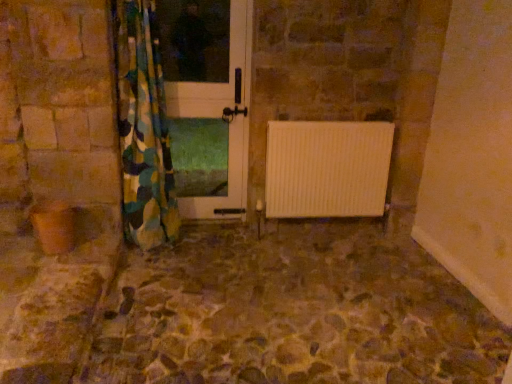
At what (x,y) coordinates should I click in order to perform the action: click on white glossy door at center. Please return your answer as a coordinate pair (x, y). Looking at the image, I should click on (219, 122).

Describe the element at coordinates (294, 311) in the screenshot. The width and height of the screenshot is (512, 384). I see `stone textured floor at center` at that location.

Locate an element on the screen. This screenshot has height=384, width=512. stone textured floor at center is located at coordinates (294, 311).

What do you see at coordinates (143, 128) in the screenshot? I see `camouflage fabric curtain at left` at bounding box center [143, 128].

The height and width of the screenshot is (384, 512). What are the coordinates of `white glossy door at center` in the screenshot? It's located at (219, 122).

Considering the relative sizes of white glossy door at center and stone textured floor at center in the image provided, is white glossy door at center taller than stone textured floor at center?

Yes, white glossy door at center is taller than stone textured floor at center.

In terms of size, does white glossy door at center appear bigger or smaller than stone textured floor at center?

In the image, white glossy door at center appears to be smaller than stone textured floor at center.

Considering the positions of objects white glossy door at center and stone textured floor at center in the image provided, who is behind, white glossy door at center or stone textured floor at center?

white glossy door at center.

Consider the image. Considering the relative positions of white glossy door at center and stone textured floor at center in the image provided, is white glossy door at center to the left of stone textured floor at center from the viewer's perspective?

Yes.

Choose the correct answer: Is stone textured floor at center inside camouflage fabric curtain at left or outside it?

stone textured floor at center cannot be found inside camouflage fabric curtain at left.

Based on the photo, from the image's perspective, who appears lower, stone textured floor at center or camouflage fabric curtain at left?

stone textured floor at center appears lower in the image.

Measure the distance from stone textured floor at center to camouflage fabric curtain at left.

A distance of 3.54 feet exists between stone textured floor at center and camouflage fabric curtain at left.

Between point (185, 301) and point (147, 118), which one is positioned behind?

The point (147, 118) is behind.

Based on their sizes in the image, would you say camouflage fabric curtain at left is bigger or smaller than white glossy door at center?

camouflage fabric curtain at left is bigger than white glossy door at center.

Is camouflage fabric curtain at left not close to white glossy door at center?

camouflage fabric curtain at left is near white glossy door at center, not far away.

Relative to white glossy door at center, is camouflage fabric curtain at left in front or behind?

Clearly, camouflage fabric curtain at left is in front of white glossy door at center.

From the image's perspective, which one is positioned lower, camouflage fabric curtain at left or white glossy door at center?

camouflage fabric curtain at left appears lower in the image.

This screenshot has width=512, height=384. I want to click on curtain below the white glossy door at center (from the image's perspective), so click(x=143, y=128).

Is white glossy door at center positioned far away from camouflage fabric curtain at left?

white glossy door at center is actually quite close to camouflage fabric curtain at left.

Which object is closer to the camera taking this photo, white glossy door at center or camouflage fabric curtain at left?

Answer: camouflage fabric curtain at left.

In the image, there is a stone textured floor at center. At what (x,y) coordinates should I click in order to perform the action: click on screen door above it (from the image's perspective). Please return your answer as a coordinate pair (x, y). Image resolution: width=512 pixels, height=384 pixels. Looking at the image, I should click on (219, 122).

Considering the sizes of stone textured floor at center and white glossy door at center in the image, is stone textured floor at center wider or thinner than white glossy door at center?

Clearly, stone textured floor at center has more width compared to white glossy door at center.

Is point (313, 372) more distant than point (212, 102)?

No, (313, 372) is in front of (212, 102).

Between camouflage fabric curtain at left and stone textured floor at center, which one has larger width?

stone textured floor at center is wider.

What are the coordinates of `curtain above the stone textured floor at center (from the image's perspective)` in the screenshot? It's located at (143, 128).

How different are the orientations of camouflage fabric curtain at left and stone textured floor at center in degrees?

The angle between the facing direction of camouflage fabric curtain at left and the facing direction of stone textured floor at center is 89.1 degrees.

The image size is (512, 384). I want to click on path to the right of white glossy door at center, so click(294, 311).

Where is `curtain behind the stone textured floor at center`? The height and width of the screenshot is (384, 512). curtain behind the stone textured floor at center is located at coordinates (143, 128).

Estimate the real-world distances between objects in this image. Which object is further from white glossy door at center, stone textured floor at center or camouflage fabric curtain at left?

stone textured floor at center is further to white glossy door at center.

From the image, which object appears to be farther from stone textured floor at center, white glossy door at center or camouflage fabric curtain at left?

Based on the image, white glossy door at center appears to be further to stone textured floor at center.

Which object lies further to the anchor point white glossy door at center, camouflage fabric curtain at left or stone textured floor at center?

Based on the image, stone textured floor at center appears to be further to white glossy door at center.

Looking at the image, which one is located closer to camouflage fabric curtain at left, white glossy door at center or stone textured floor at center?

white glossy door at center is closer to camouflage fabric curtain at left.

Based on the photo, based on their spatial positions, is stone textured floor at center or white glossy door at center further from camouflage fabric curtain at left?

stone textured floor at center is further to camouflage fabric curtain at left.

Which object lies further to the anchor point stone textured floor at center, camouflage fabric curtain at left or white glossy door at center?

white glossy door at center is further to stone textured floor at center.

Where is `curtain between white glossy door at center and stone textured floor at center vertically`? The width and height of the screenshot is (512, 384). curtain between white glossy door at center and stone textured floor at center vertically is located at coordinates (143, 128).